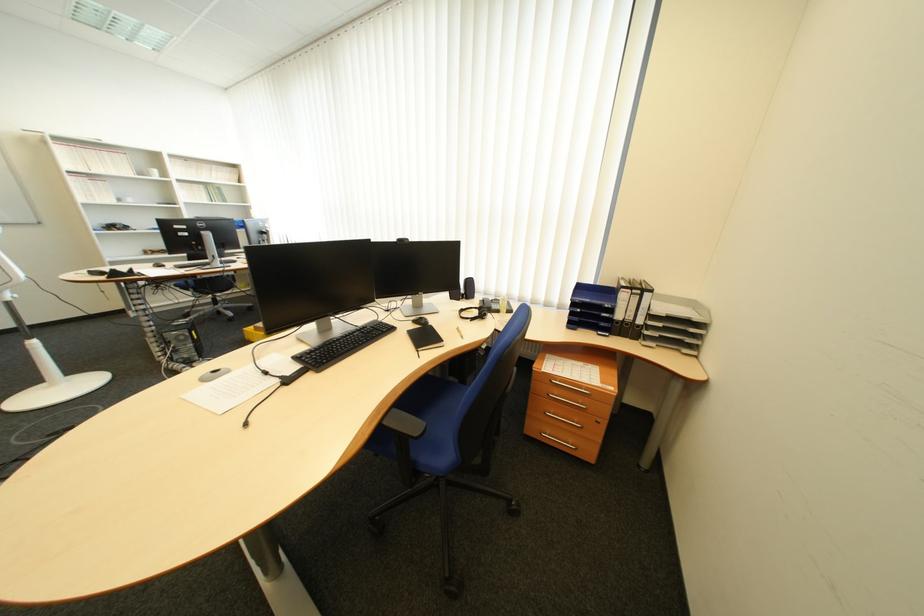
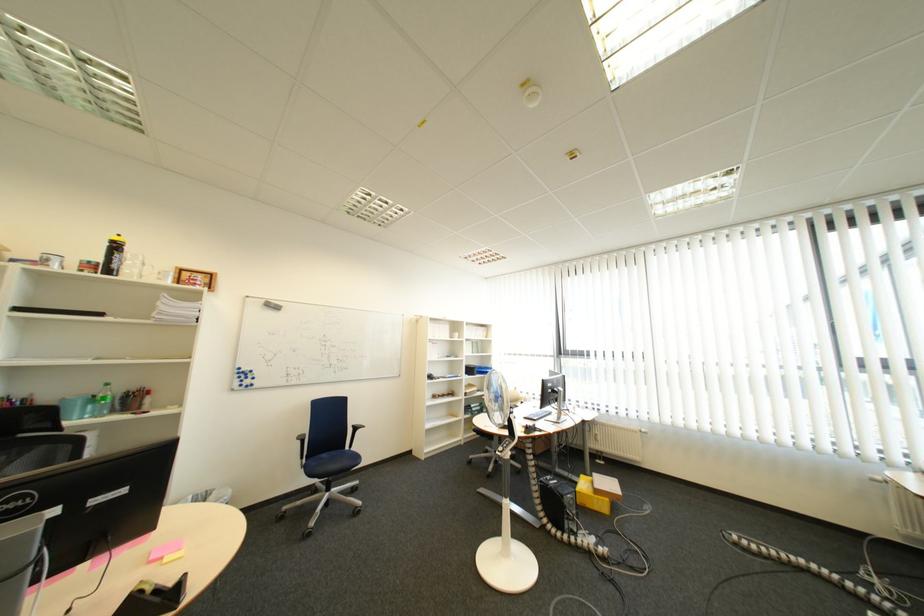
Where in the second image is the point corresponding to pixel 195 339 from the first image?

(585, 503)